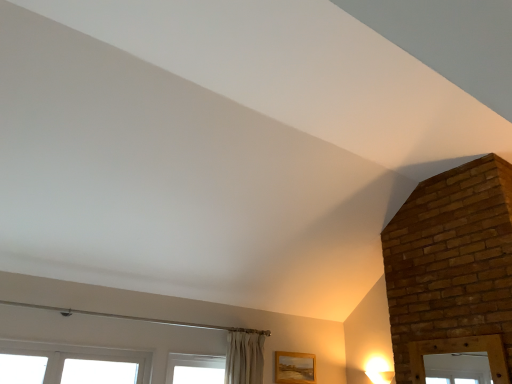
Question: Is matte white light fixture at lower right taller than wooden frame at lower right?

Choices:
 (A) yes
 (B) no

Answer: (B)

Question: Is matte white light fixture at lower right next to wooden frame at lower right?

Choices:
 (A) yes
 (B) no

Answer: (B)

Question: Is matte white light fixture at lower right turned away from wooden frame at lower right?

Choices:
 (A) yes
 (B) no

Answer: (B)

Question: From a real-world perspective, is matte white light fixture at lower right positioned over wooden frame at lower right based on gravity?

Choices:
 (A) yes
 (B) no

Answer: (B)

Question: Would you say matte white light fixture at lower right is a long distance from wooden frame at lower right?

Choices:
 (A) no
 (B) yes

Answer: (A)

Question: Choose the correct answer: Is wooden frame at lower right inside matte white light fixture at lower right or outside it?

Choices:
 (A) outside
 (B) inside

Answer: (A)

Question: From a real-world perspective, is wooden frame at lower right above or below matte white light fixture at lower right?

Choices:
 (A) above
 (B) below

Answer: (A)

Question: Considering the positions of wooden frame at lower right and matte white light fixture at lower right in the image, is wooden frame at lower right taller or shorter than matte white light fixture at lower right?

Choices:
 (A) short
 (B) tall

Answer: (B)

Question: Does point (303, 370) appear closer or farther from the camera than point (380, 365)?

Choices:
 (A) closer
 (B) farther

Answer: (B)

Question: From the image's perspective, relative to white plastic window at lower left, is matte white light fixture at lower right above or below?

Choices:
 (A) above
 (B) below

Answer: (B)

Question: Considering the positions of matte white light fixture at lower right and white plastic window at lower left in the image, is matte white light fixture at lower right wider or thinner than white plastic window at lower left?

Choices:
 (A) wide
 (B) thin

Answer: (A)

Question: Is point (377, 364) closer or farther from the camera than point (56, 374)?

Choices:
 (A) closer
 (B) farther

Answer: (B)

Question: Considering the positions of matte white light fixture at lower right and white plastic window at lower left in the image, is matte white light fixture at lower right taller or shorter than white plastic window at lower left?

Choices:
 (A) tall
 (B) short

Answer: (B)

Question: Is wooden frame at lower right in front of or behind white plastic window at lower left in the image?

Choices:
 (A) behind
 (B) front

Answer: (A)

Question: From a real-world perspective, is wooden frame at lower right above or below white plastic window at lower left?

Choices:
 (A) below
 (B) above

Answer: (B)